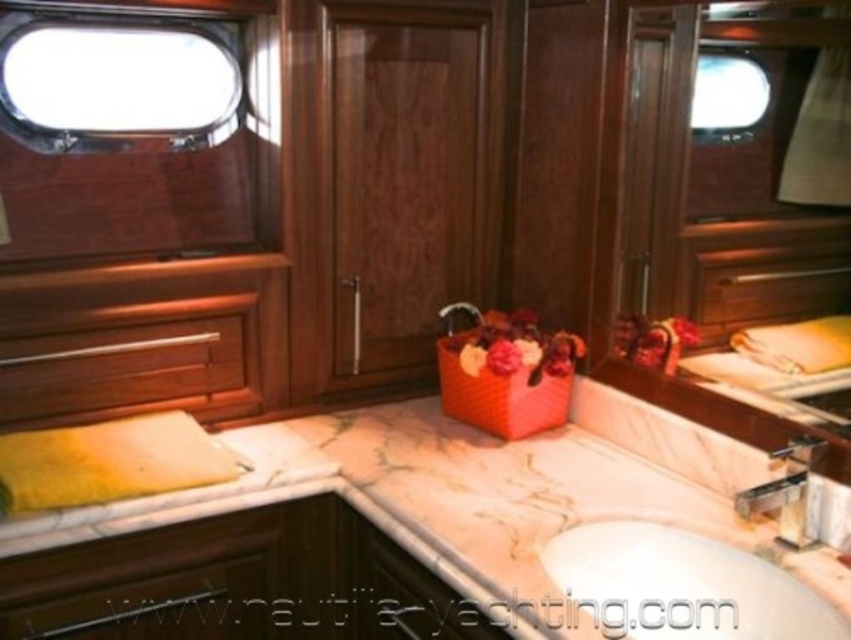
Question: Is silver metallic faucet at center to the right of satin nickel faucet at center from the viewer's perspective?

Choices:
 (A) no
 (B) yes

Answer: (B)

Question: Considering the relative positions of silver metallic faucet at center and satin nickel faucet at center in the image provided, where is silver metallic faucet at center located with respect to satin nickel faucet at center?

Choices:
 (A) above
 (B) below

Answer: (B)

Question: Is white glossy sink at center to the right of silver metallic faucet at center from the viewer's perspective?

Choices:
 (A) yes
 (B) no

Answer: (B)

Question: Which object appears closest to the camera in this image?

Choices:
 (A) satin nickel faucet at center
 (B) glossy wood mirror at upper right

Answer: (B)

Question: Among these objects, which one is farthest from the camera?

Choices:
 (A) satin nickel faucet at center
 (B) glossy wood mirror at upper right
 (C) white glossy sink at center

Answer: (A)

Question: Which point is farther from the camera taking this photo?

Choices:
 (A) click(798, 522)
 (B) click(460, 307)
 (C) click(698, 616)
 (D) click(212, 584)

Answer: (B)